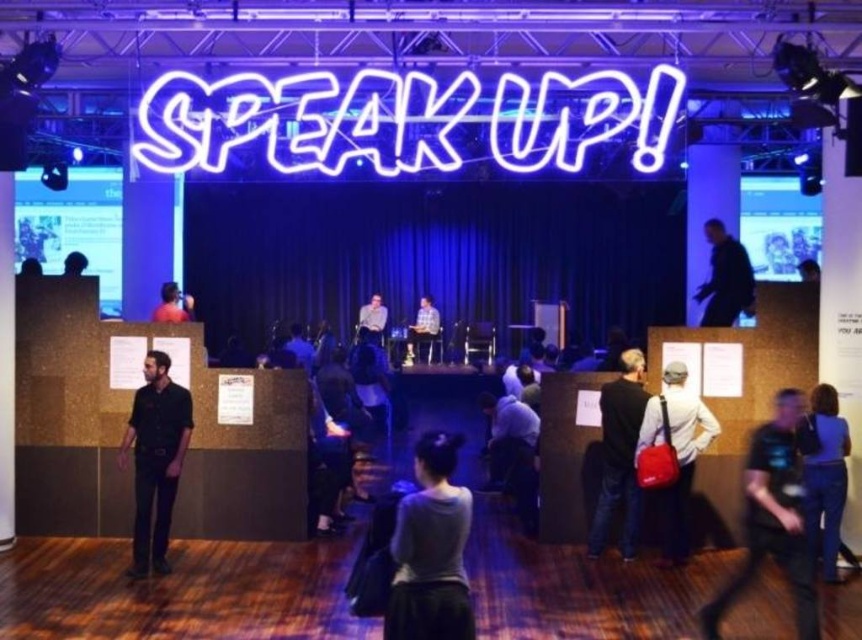
You are standing at the origin point in the image. Where is the gray matte sweater at center located in terms of coordinates?

The gray matte sweater at center is located at coordinates point (431, 548).

You are an event organizer who needs to guide a guest to the registration desk located at the back of the room. The guest is currently standing near the gray matte sweater at center and the blue fabric jacket at lower right. Which direction should they move to reach the registration desk?

The guest should move towards the left since the gray matte sweater at center is to the left of the blue fabric jacket at lower right, and the registration desk is at the back of the room.

You are an event organizer who needs to retrieve a matte red bag at center right and a light brown leather jacket at center for an upcoming presentation. Based on the scene description, which object is positioned lower in the image?

The matte red bag at center right is located below the light brown leather jacket at center, so the matte red bag at center right is positioned lower in the image.